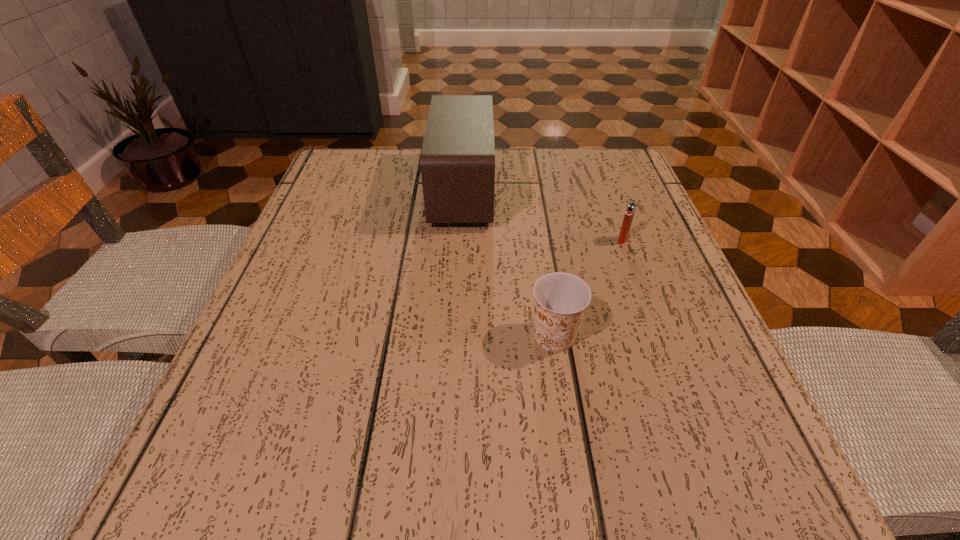
Find the location of `free point that satisfies the following two spatial constraints: 1. on the back side of the second object from left to right; 2. on the left side of the rightmost object`. free point that satisfies the following two spatial constraints: 1. on the back side of the second object from left to right; 2. on the left side of the rightmost object is located at coordinates (540, 240).